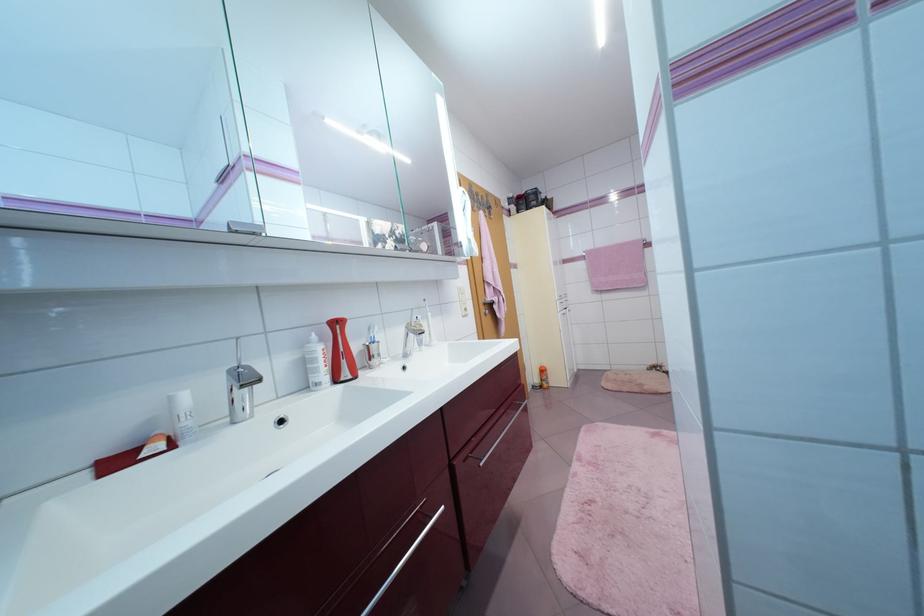
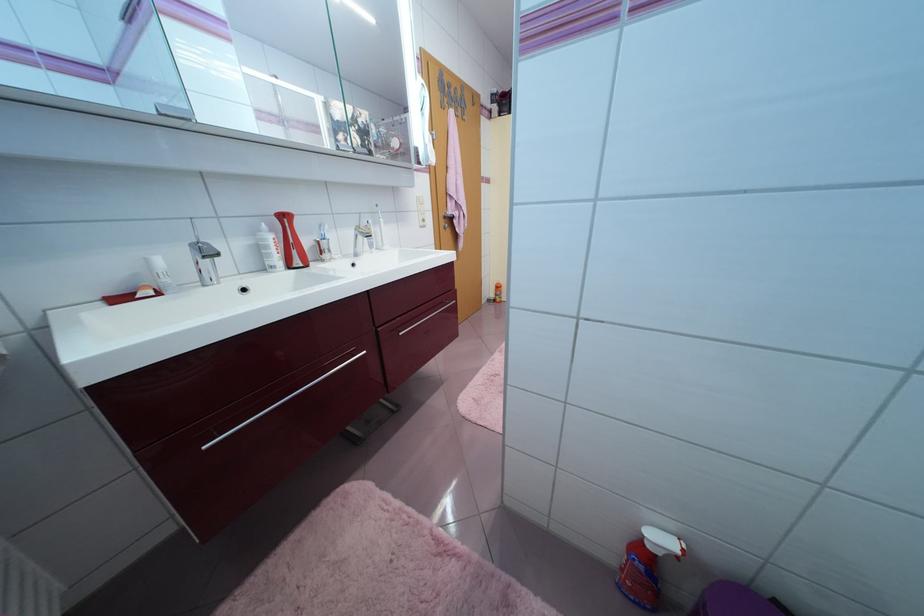
Where in the second image is the point corresponding to point 347,379 from the first image?

(299, 267)